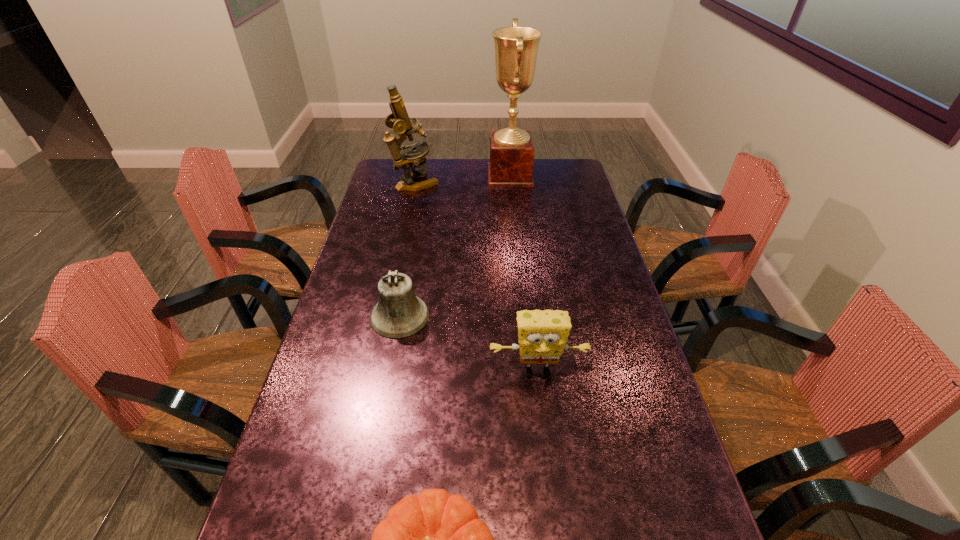
Locate an element on the screen. This screenshot has width=960, height=540. free space between the trophy cup and the bell is located at coordinates (455, 246).

I want to click on free area in between the sponge and the bell, so click(x=468, y=344).

The width and height of the screenshot is (960, 540). I want to click on vacant area that lies between the fourth shortest object and the sponge, so click(x=476, y=278).

Identify the location of vacant area between the bell and the tallest object. (455, 246).

Identify the location of unoccupied position between the third nearest object and the tallest object. (455, 246).

Locate an element on the screen. Image resolution: width=960 pixels, height=540 pixels. object identified as the second closest to the tallest object is located at coordinates (398, 314).

Choose which object is the third nearest neighbor to the bell. Please provide its 2D coordinates. Your answer should be formatted as a tuple, i.e. [(x, y)], where the tuple contains the x and y coordinates of a point satisfying the conditions above.

[(399, 120)]